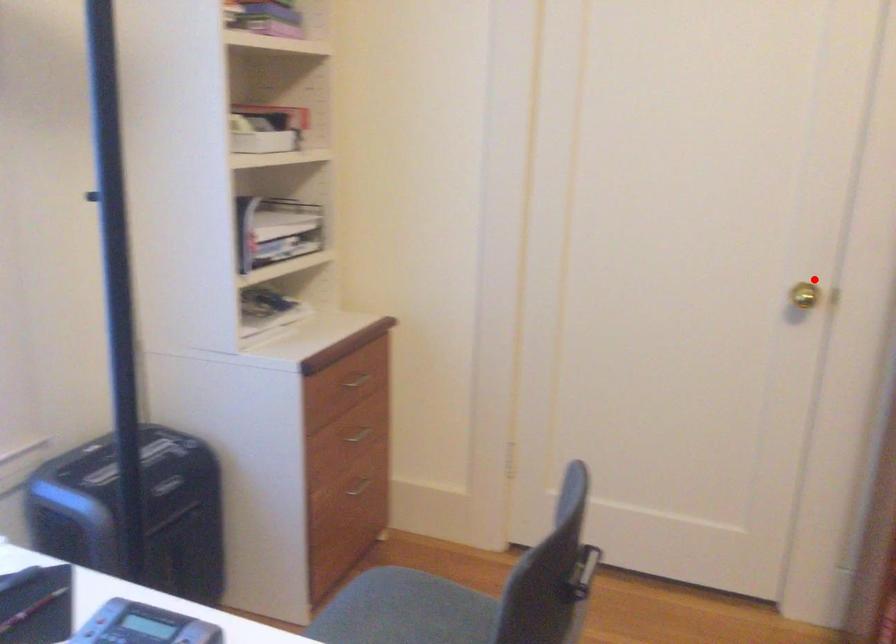
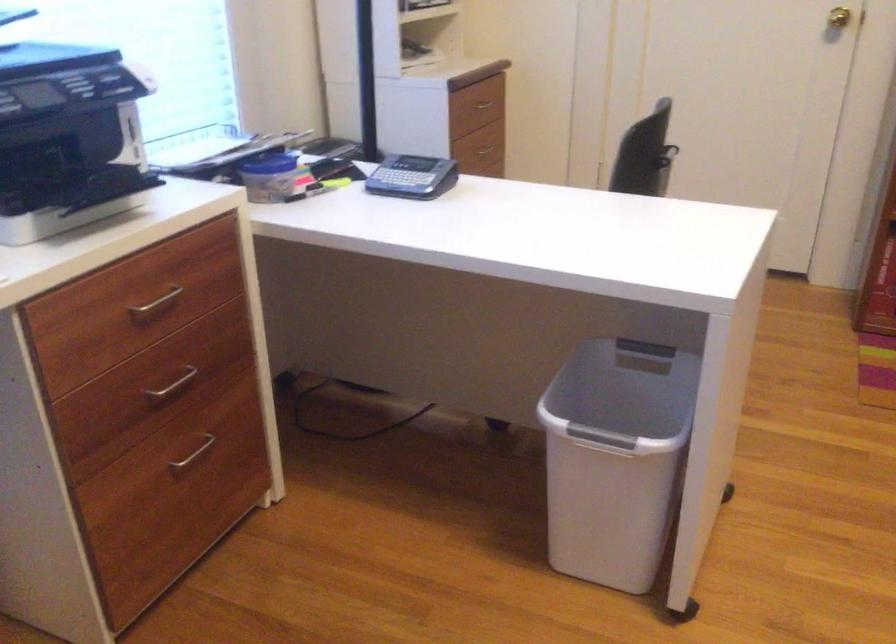
Question: A red point is marked in image1. In image2, is the corresponding 3D point closer to the camera or farther? Reply with the corresponding letter.

Choices:
 (A) The corresponding 3D point is closer.
 (B) The corresponding 3D point is farther.

Answer: (B)